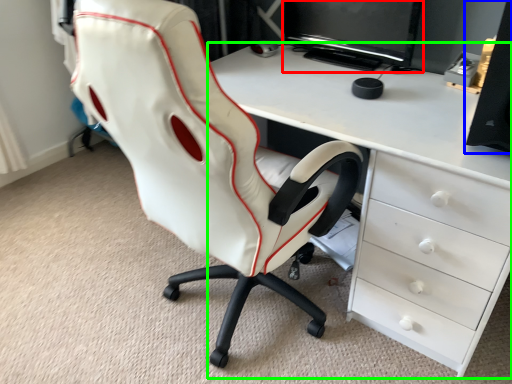
Question: Considering the real-world distances, which object is closest to computer monitor (highlighted by a red box)? speaker (highlighted by a blue box) or desk (highlighted by a green box).

Choices:
 (A) speaker
 (B) desk

Answer: (B)